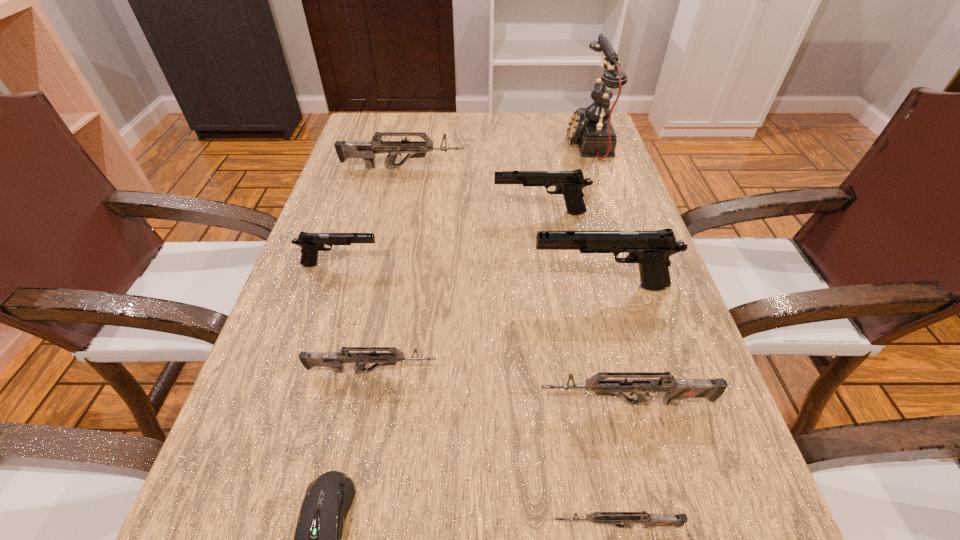
Identify the location of free space between the eighth shortest object and the black telephone. The width and height of the screenshot is (960, 540). (594, 215).

Choose which object is the nearest neighbor to the third smallest grey gun. Please provide its 2D coordinates. Your answer should be formatted as a tuple, i.e. [(x, y)], where the tuple contains the x and y coordinates of a point satisfying the conditions above.

[(617, 519)]

Locate an element on the screen. the eighth closest object to the farthest black gun is located at coordinates (617, 519).

The image size is (960, 540). Find the location of `gun object that ranks as the seventh closest to the black telephone`. gun object that ranks as the seventh closest to the black telephone is located at coordinates (617, 519).

Identify which gun is located as the nearest to the seventh tallest object. Please provide its 2D coordinates. Your answer should be formatted as a tuple, i.e. [(x, y)], where the tuple contains the x and y coordinates of a point satisfying the conditions above.

[(676, 389)]

Identify which black gun is located as the third nearest to the sixth farthest gun. Please provide its 2D coordinates. Your answer should be formatted as a tuple, i.e. [(x, y)], where the tuple contains the x and y coordinates of a point satisfying the conditions above.

[(570, 183)]

The image size is (960, 540). What are the coordinates of `the third closest black gun to the computer equipment` in the screenshot? It's located at (570, 183).

You are a GUI agent. You are given a task and a screenshot of the screen. Output one action in this format:
    pyautogui.click(x=<x>, y=<y>)
    Task: Click on the grey gun that is the second closest one to the third biggest grey gun
    
    Given the screenshot: What is the action you would take?
    pyautogui.click(x=617, y=519)

Locate an element on the screen. This screenshot has width=960, height=540. grey gun object that ranks as the second closest to the sixth farthest gun is located at coordinates (335, 360).